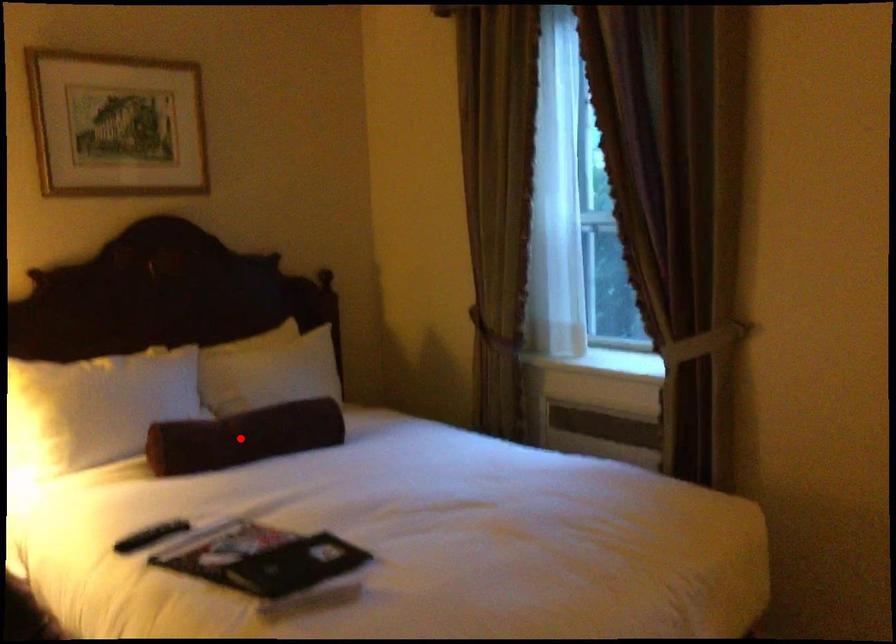
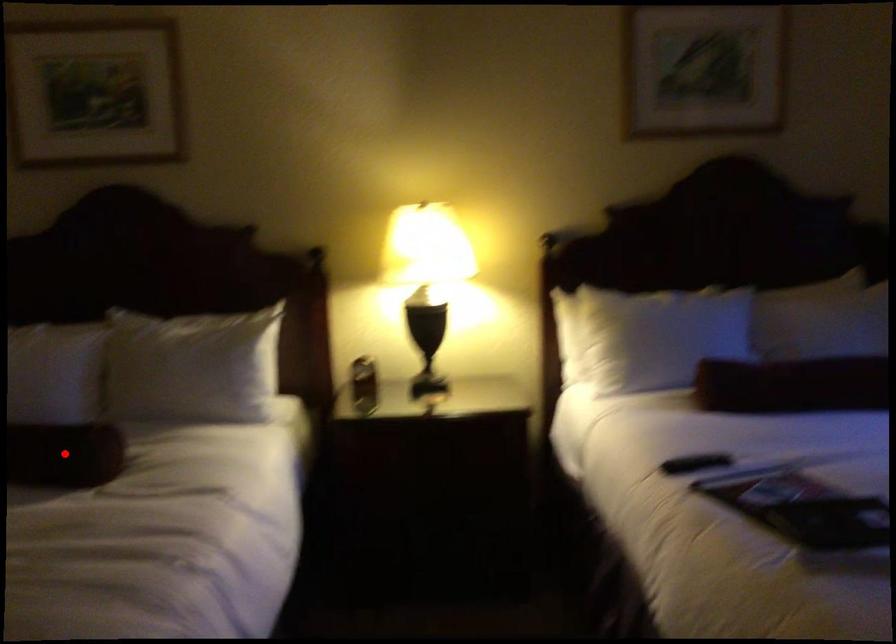
I am providing you with two images of the same scene from different viewpoints. A red point is marked on the first image and another point is marked on the second image. Are the points marked in image1 and image2 representing the same 3D position?

No